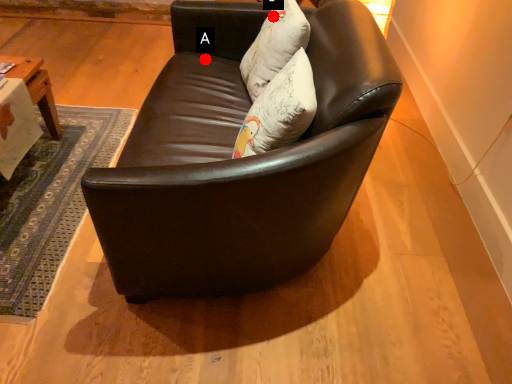
Question: Two points are circled on the image, labeled by A and B beside each circle. Which point is closer to the camera?

Choices:
 (A) A is closer
 (B) B is closer

Answer: (B)